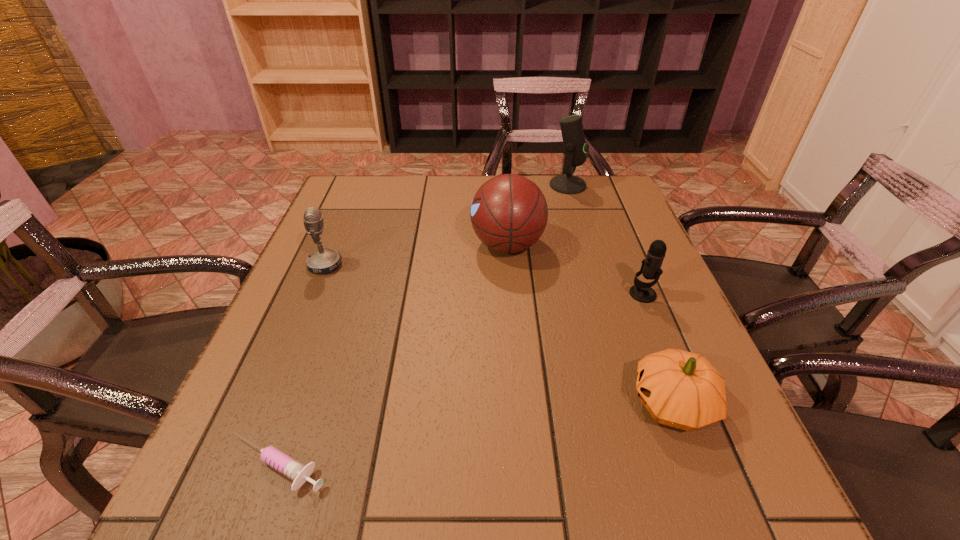
At what (x,y) coordinates should I click in order to perform the action: click on the farthest microphone. Please return your answer as a coordinate pair (x, y). Looking at the image, I should click on (575, 148).

You are a GUI agent. You are given a task and a screenshot of the screen. Output one action in this format:
    pyautogui.click(x=<x>, y=<y>)
    Task: Click on the second microphone from left to right
    
    Given the screenshot: What is the action you would take?
    pyautogui.click(x=575, y=148)

This screenshot has height=540, width=960. What are the coordinates of `the third object from left to right` in the screenshot? It's located at (509, 213).

The image size is (960, 540). Find the location of `the leftmost microphone`. the leftmost microphone is located at coordinates (324, 260).

The width and height of the screenshot is (960, 540). I want to click on the nearest microphone, so click(x=651, y=269).

Where is `the fourth farthest object`? The image size is (960, 540). the fourth farthest object is located at coordinates (651, 269).

Where is `the fifth tallest object`? Image resolution: width=960 pixels, height=540 pixels. the fifth tallest object is located at coordinates (681, 389).

The image size is (960, 540). Identify the location of syringe. (x=297, y=472).

This screenshot has width=960, height=540. I want to click on free space located on the front of the farthest object, so click(581, 230).

Identify the location of vacant space located on the front of the basketball. Image resolution: width=960 pixels, height=540 pixels. (514, 329).